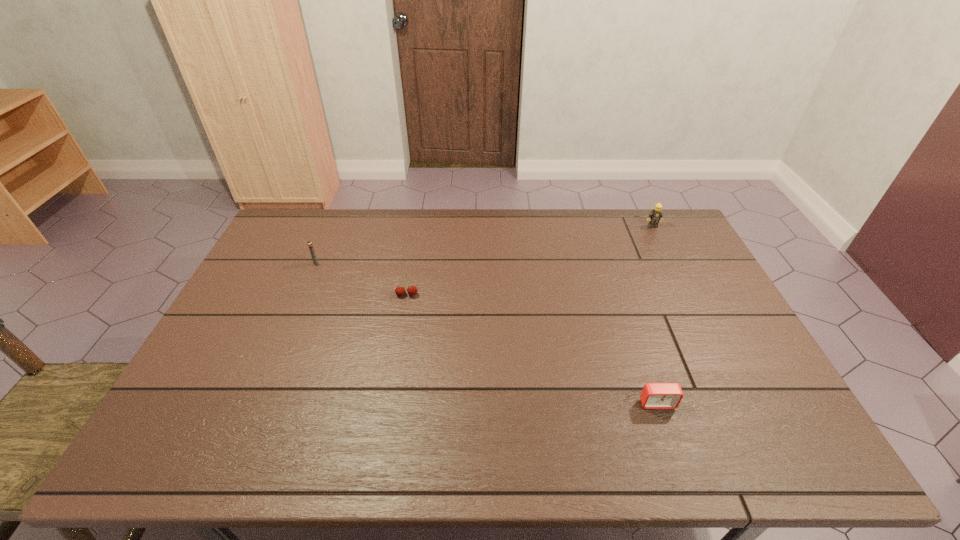
I want to click on vacant space at the far right corner of the desktop, so click(x=674, y=219).

Where is `free space between the rightmost object and the igniter`? free space between the rightmost object and the igniter is located at coordinates (484, 245).

I want to click on free space between the leftmost object and the farthest object, so click(484, 245).

This screenshot has height=540, width=960. What are the coordinates of `free space that is in between the nearest object and the igniter` in the screenshot? It's located at (487, 333).

The image size is (960, 540). I want to click on vacant point located between the second farthest object and the alarm clock, so click(487, 333).

Locate an element on the screen. This screenshot has height=540, width=960. free space between the second nearest object and the leftmost object is located at coordinates (361, 279).

Locate an element on the screen. Image resolution: width=960 pixels, height=540 pixels. free space between the shortest object and the second nearest object is located at coordinates (532, 349).

I want to click on unoccupied position between the alarm clock and the cherry, so click(x=532, y=349).

I want to click on free space between the cherry and the second object from right to left, so click(532, 349).

Image resolution: width=960 pixels, height=540 pixels. Identify the location of free space between the rightmost object and the third nearest object. (484, 245).